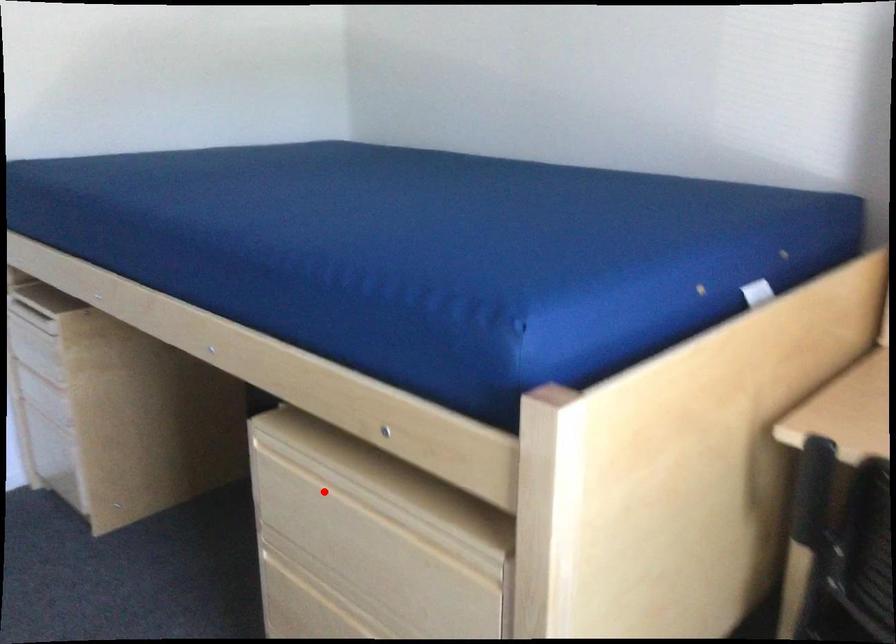
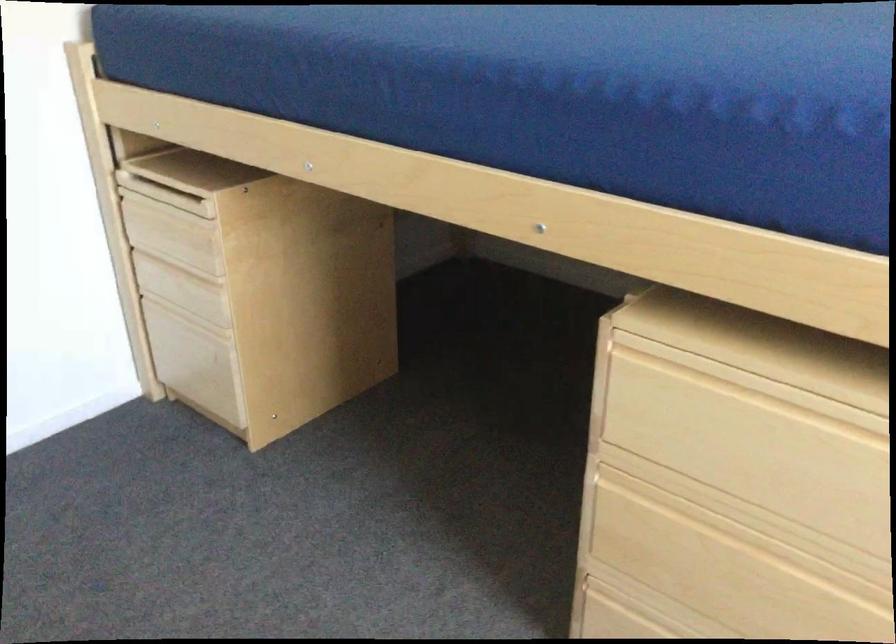
Where in the second image is the point corresponding to the highlighted location from the first image?

(743, 406)